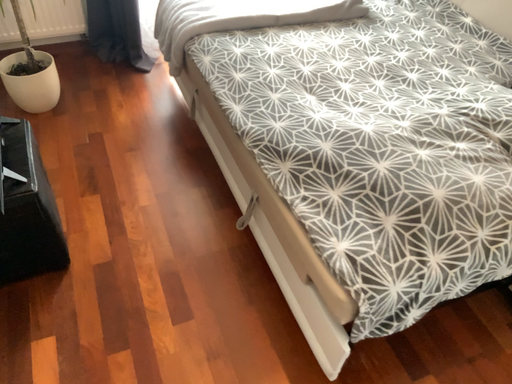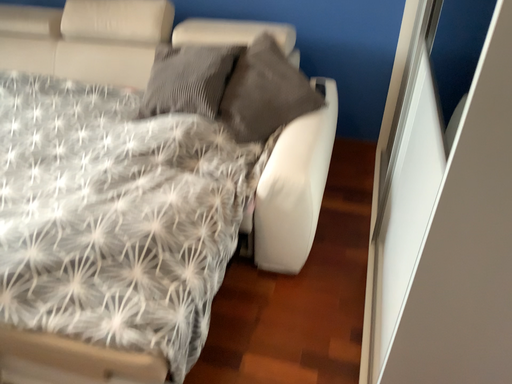
Question: How did the camera likely rotate when shooting the video?

Choices:
 (A) rotated right
 (B) rotated left

Answer: (A)